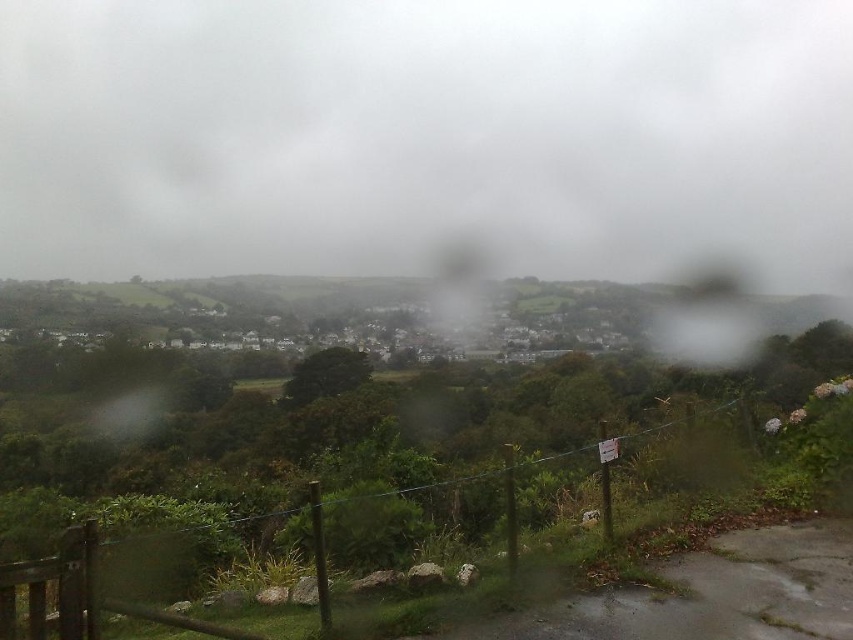
You are an artist sketching the landscape and want to emphasize the scale difference between the white fluffy cloud at upper center and the wooden fence at lower center. Which object should you draw larger to achieve this effect?

To emphasize the scale difference, you should draw the white fluffy cloud at upper center larger than the wooden fence at lower center since it is actually larger in size according to the description.

You are standing at the edge of the wooden fence and want to take a photo of the white fluffy cloud at upper center. The camera you have can focus on objects up to 100 meters away. Will the cloud be in focus?

The white fluffy cloud at upper center is 111.32 meters from the viewer, which is beyond the camera focus range of 100 meters. The cloud will not be in focus.